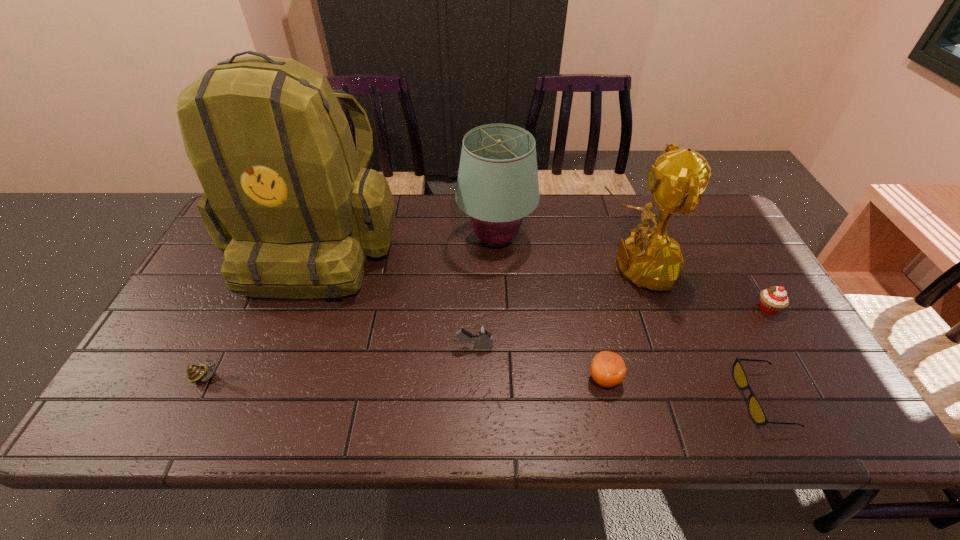
I want to click on object that is at the near right corner, so click(x=757, y=413).

The width and height of the screenshot is (960, 540). Identify the location of vacant point at the far edge. (585, 206).

Where is `vacant area at the near edge`? The width and height of the screenshot is (960, 540). vacant area at the near edge is located at coordinates (683, 402).

Identify the location of vacant space at the left edge of the desktop. Image resolution: width=960 pixels, height=540 pixels. (186, 361).

Where is `vacant area at the right edge`? The image size is (960, 540). vacant area at the right edge is located at coordinates (727, 267).

The height and width of the screenshot is (540, 960). I want to click on free space between the orange and the backpack, so (461, 311).

The width and height of the screenshot is (960, 540). In order to click on unoccupied area between the orange and the rightmost object in this screenshot , I will do pos(685,343).

Where is `free area in between the rightmost object and the orange`? This screenshot has height=540, width=960. free area in between the rightmost object and the orange is located at coordinates (685, 343).

Find the location of a particular element. free area in between the award and the fourth nearest object is located at coordinates (554, 307).

The image size is (960, 540). I want to click on free spot between the lampshade and the tallest object, so click(x=406, y=241).